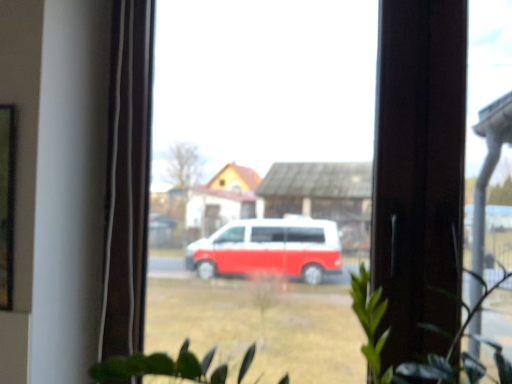
Describe the element at coordinates (6, 203) in the screenshot. I see `metallic glass frame at left` at that location.

You are a GUI agent. You are given a task and a screenshot of the screen. Output one action in this format:
    pyautogui.click(x=<x>, y=<y>)
    Task: Click on the metallic glass frame at left
    Image resolution: width=512 pixels, height=384 pixels.
    Given the screenshot: What is the action you would take?
    click(x=6, y=203)

In order to face metallic glass frame at left, should I rotate leftwards or rightwards?

Turn left approximately 35.264 degrees to face it.

Locate an element on the screen. The height and width of the screenshot is (384, 512). metallic glass frame at left is located at coordinates (6, 203).